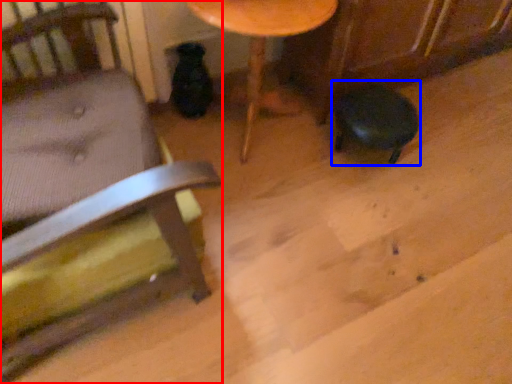
Question: Which point is closer to the camera, chair (highlighted by a red box) or bar stool (highlighted by a blue box)?

Choices:
 (A) chair
 (B) bar stool

Answer: (A)